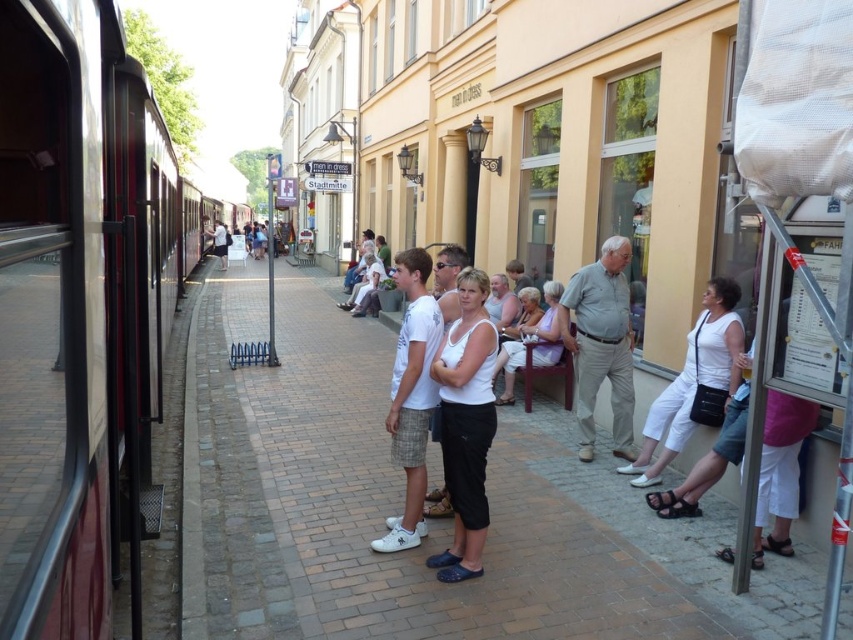
Question: Which object is the closest to the gray cotton shirt at center?

Choices:
 (A) light purple fabric chair at center
 (B) white cotton shirt at center

Answer: (A)

Question: Does white cotton tank top at center appear on the left side of white matte shorts at center?

Choices:
 (A) yes
 (B) no

Answer: (B)

Question: Does white cotton tank top at center appear over white cotton pants at center?

Choices:
 (A) no
 (B) yes

Answer: (A)

Question: Among these objects, which one is nearest to the camera?

Choices:
 (A) white cotton shirt at center
 (B) brick pavement at center
 (C) white cotton tank top at center

Answer: (B)

Question: Which point appears farthest from the camera in this image?

Choices:
 (A) click(x=393, y=548)
 (B) click(x=463, y=509)

Answer: (A)

Question: Can you confirm if brick pavement at center is wider than white cotton pants at center?

Choices:
 (A) yes
 (B) no

Answer: (A)